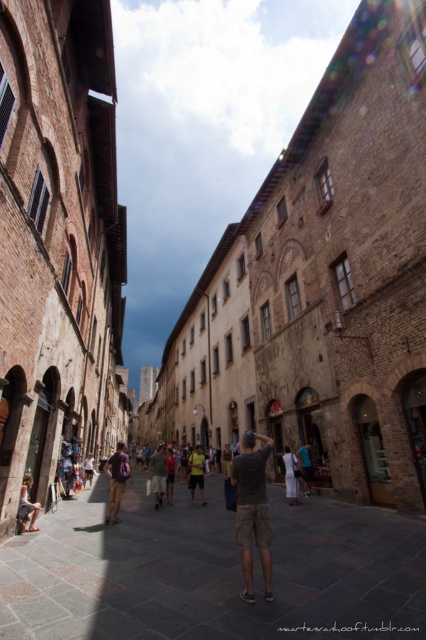
Who is shorter, brown stone alley at center or light brown leather bag at lower left?

light brown leather bag at lower left is shorter.

Can you confirm if brown stone alley at center is thinner than light brown leather bag at lower left?

No.

Is point (95, 605) positioned in front of point (34, 509)?

Yes.

This screenshot has width=426, height=640. Identify the location of brown stone alley at center. (210, 572).

Is point (25, 500) behind point (290, 454)?

No, it is in front of (290, 454).

Can you confirm if light brown leather bag at lower left is positioned to the left of white cotton dress at center?

Yes, light brown leather bag at lower left is to the left of white cotton dress at center.

What do you see at coordinates (26, 506) in the screenshot? This screenshot has width=426, height=640. I see `light brown leather bag at lower left` at bounding box center [26, 506].

Identify the location of light brown leather bag at lower left. The image size is (426, 640). (26, 506).

Does dark gray cotton t-shirt at center have a larger size compared to light brown backpack at center?

No, dark gray cotton t-shirt at center is not bigger than light brown backpack at center.

Between dark gray cotton t-shirt at center and light brown backpack at center, which one is positioned lower?

light brown backpack at center is lower down.

Locate an element on the screen. dark gray cotton t-shirt at center is located at coordinates 253,509.